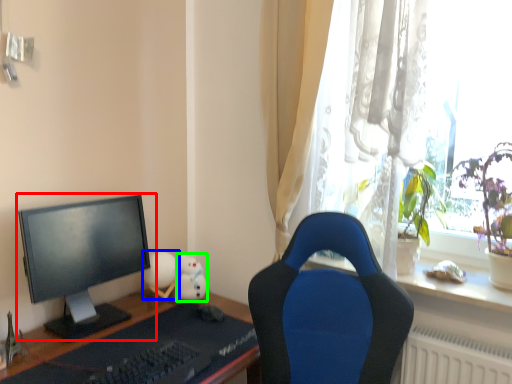
Question: Considering the real-world distances, which object is closest to computer monitor (highlighted by a red box)? toy (highlighted by a blue box) or toy (highlighted by a green box).

Choices:
 (A) toy
 (B) toy

Answer: (A)